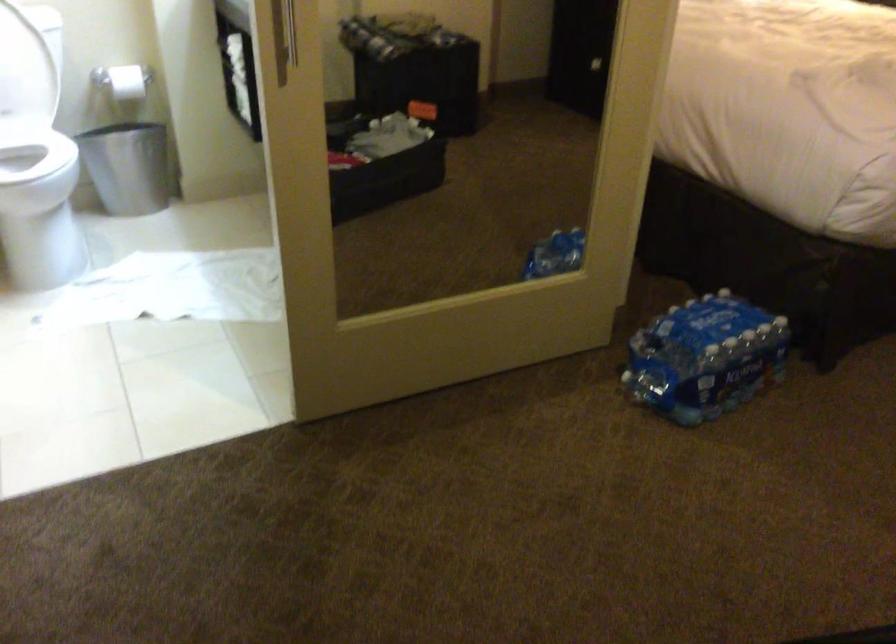
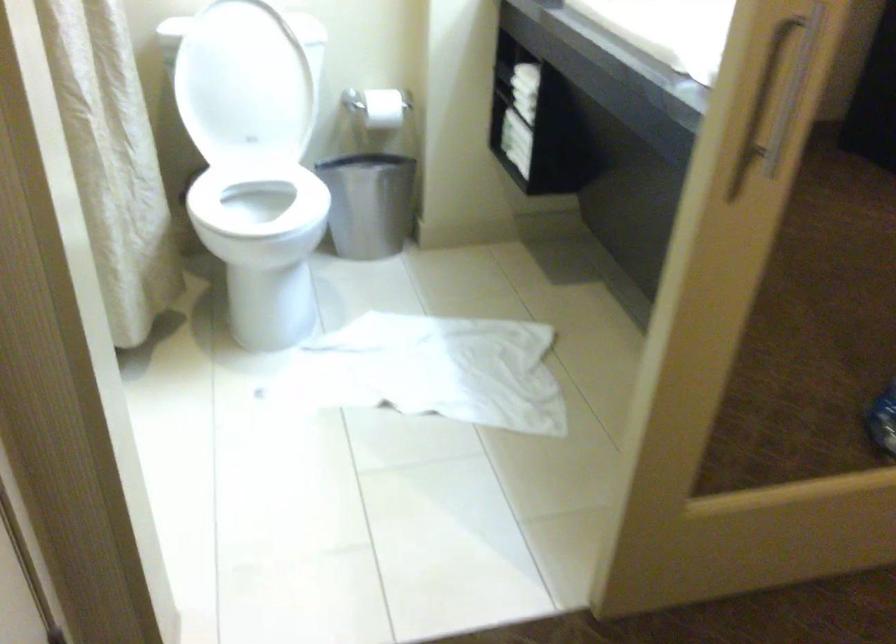
Find the pixel in the second image that matches (185,285) in the first image.

(429, 371)